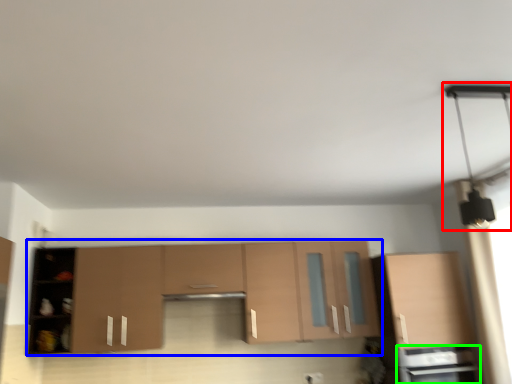
Question: Estimate the real-world distances between objects in this image. Which object is closer to light fixture (highlighted by a red box), cabinetry (highlighted by a blue box) or appliance (highlighted by a green box)?

Choices:
 (A) cabinetry
 (B) appliance

Answer: (B)